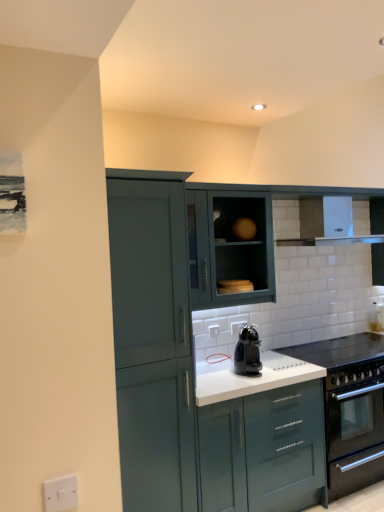
The image size is (384, 512). I want to click on free space in front of black plastic coffee machine at center, so click(254, 380).